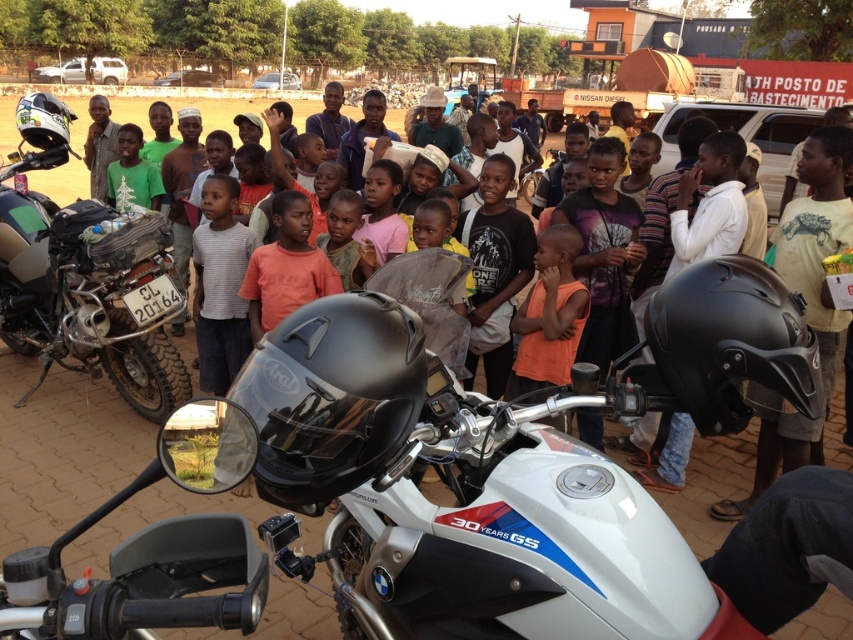
Between matte black motorcycle at left and orange matte shirt at center, which one has less height?

Standing shorter between the two is orange matte shirt at center.

Can you confirm if matte black motorcycle at left is taller than orange matte shirt at center?

Indeed, matte black motorcycle at left has a greater height compared to orange matte shirt at center.

Does point (13, 320) come closer to viewer compared to point (296, 266)?

No.

You are a GUI agent. You are given a task and a screenshot of the screen. Output one action in this format:
    pyautogui.click(x=<x>, y=<y>)
    Task: Click on the matte black motorcycle at left
    
    Given the screenshot: What is the action you would take?
    pyautogui.click(x=85, y=278)

Can you confirm if matte black motorcycle at left is smaller than light brown skin at center?

Result: No, matte black motorcycle at left is not smaller than light brown skin at center.

Can you confirm if matte black motorcycle at left is positioned above light brown skin at center?

→ No, matte black motorcycle at left is not above light brown skin at center.

Does point (167, 374) come behind point (352, 228)?

That is True.

The height and width of the screenshot is (640, 853). In order to click on matte black motorcycle at left in this screenshot , I will do `click(85, 278)`.

Who is positioned more to the left, white matte motorcycle at center or light brown skin at center?

light brown skin at center

Does white matte motorcycle at center come in front of light brown skin at center?

That is True.

Between point (7, 584) and point (367, 269), which one is positioned behind?

The point (367, 269) is more distant.

The height and width of the screenshot is (640, 853). Identify the location of white matte motorcycle at center. (445, 477).